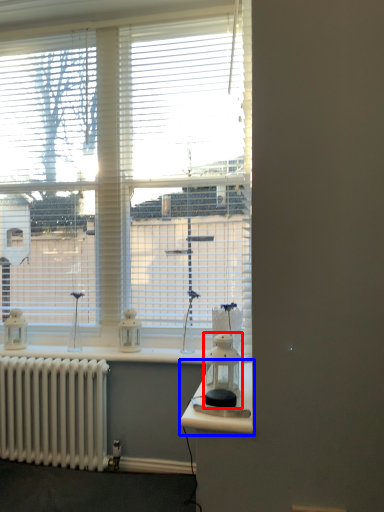
Question: Which object is closer to the camera taking this photo, appliance (highlighted by a red box) or table (highlighted by a blue box)?

Choices:
 (A) appliance
 (B) table

Answer: (B)